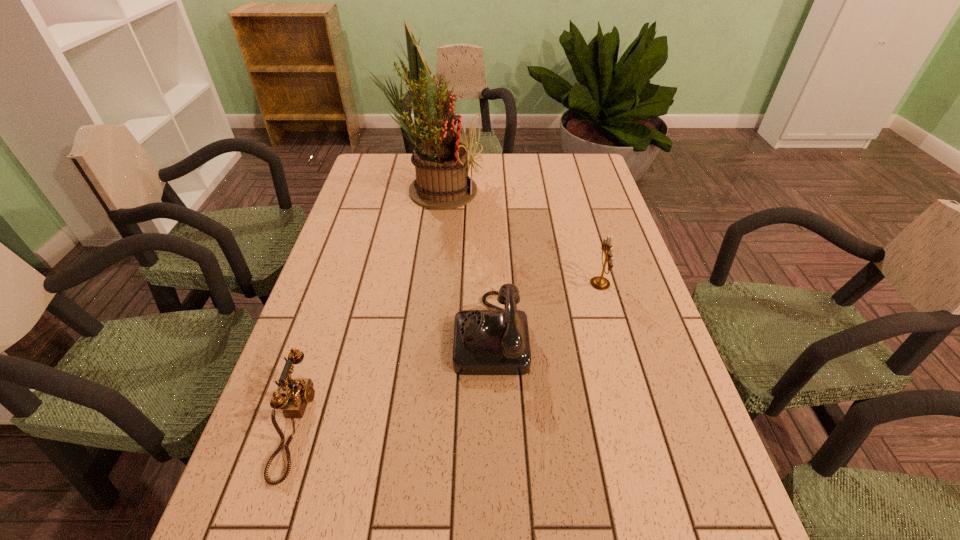
Locate an element on the screen. The image size is (960, 540). free space located on the dial of the right telephone is located at coordinates (344, 333).

Where is `free space located on the dial of the right telephone`? free space located on the dial of the right telephone is located at coordinates (429, 333).

In order to click on free region located 0.110m on the front-facing side of the shortest object in this screenshot , I will do `click(364, 424)`.

Image resolution: width=960 pixels, height=540 pixels. I want to click on object that is at the far edge, so click(441, 162).

The image size is (960, 540). In order to click on flower arrangement that is at the left edge in this screenshot , I will do `click(441, 162)`.

Locate an element on the screen. This screenshot has height=540, width=960. telephone located in the left edge section of the desktop is located at coordinates (300, 392).

Find the location of a particular element. The width and height of the screenshot is (960, 540). object present at the right edge is located at coordinates (599, 282).

The image size is (960, 540). I want to click on object at the far left corner, so click(x=441, y=162).

Locate an element on the screen. free space at the far edge of the desktop is located at coordinates (409, 170).

Locate an element on the screen. The image size is (960, 540). free spot at the left edge of the desktop is located at coordinates (370, 301).